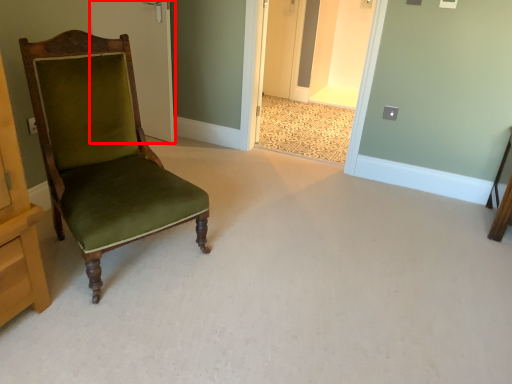
Question: Observing the image, what is the correct spatial positioning of door (annotated by the red box) in reference to chair?

Choices:
 (A) left
 (B) right

Answer: (A)